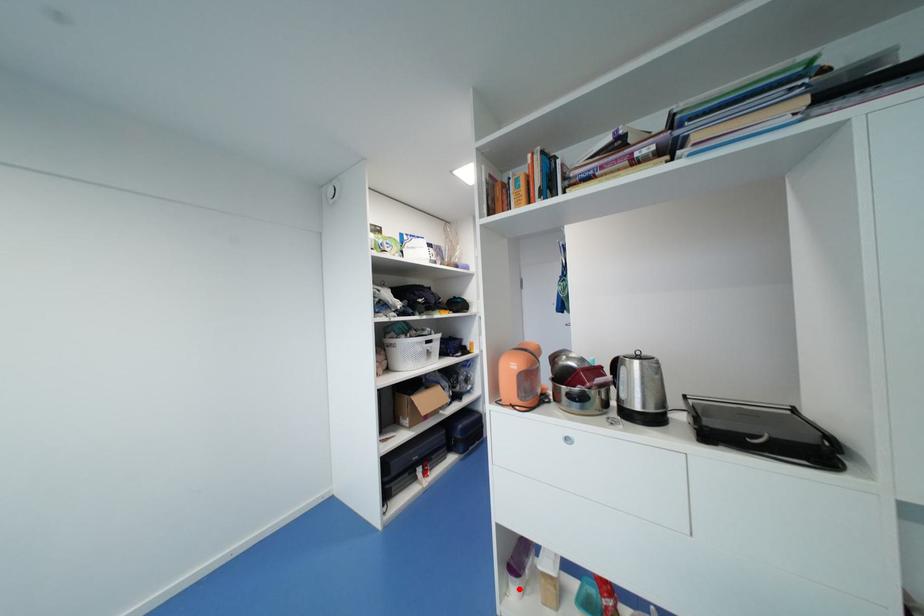
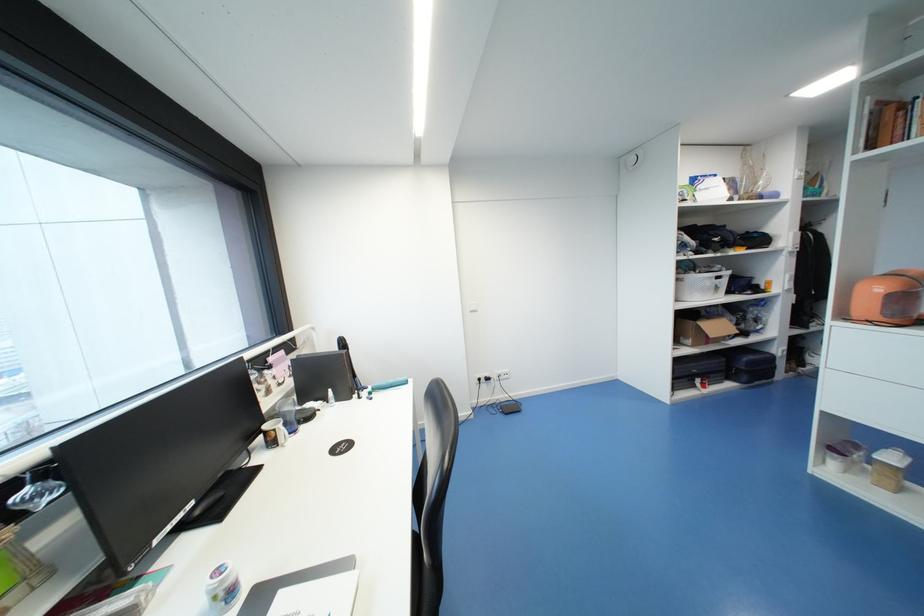
Question: I am providing you with two images of the same scene from different viewpoints. Image1 has a red point marked. In image2, the corresponding 3D location appears at what relative position? Reply with the corresponding letter.

Choices:
 (A) Closer
 (B) Farther

Answer: (A)